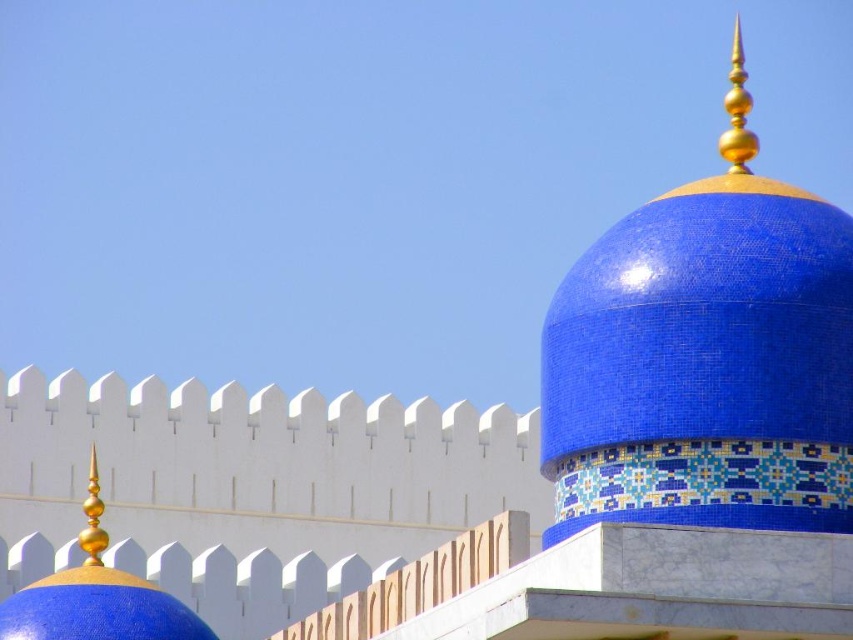
You are an architect examining the building from the front. You need to determine which structure is nearer to you between the blue mosaic dome at upper right and the shiny gold spire at left. Which one is closer?

The blue mosaic dome at upper right is closer to the viewer than the shiny gold spire at left.

You are an architect assessing the building structure. You need to determine which object, the blue mosaic dome at upper right or the shiny gold spire at left, requires more material for a restoration project. Based on their sizes, which would need more resources?

The blue mosaic dome at upper right requires more material for restoration because it is larger in size than the shiny gold spire at left.